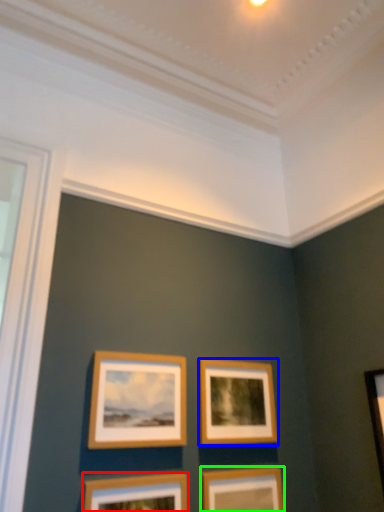
Question: Which object is the closest to the picture frame (highlighted by a red box)? Choose among these: picture frame (highlighted by a blue box) or picture frame (highlighted by a green box).

Choices:
 (A) picture frame
 (B) picture frame

Answer: (B)